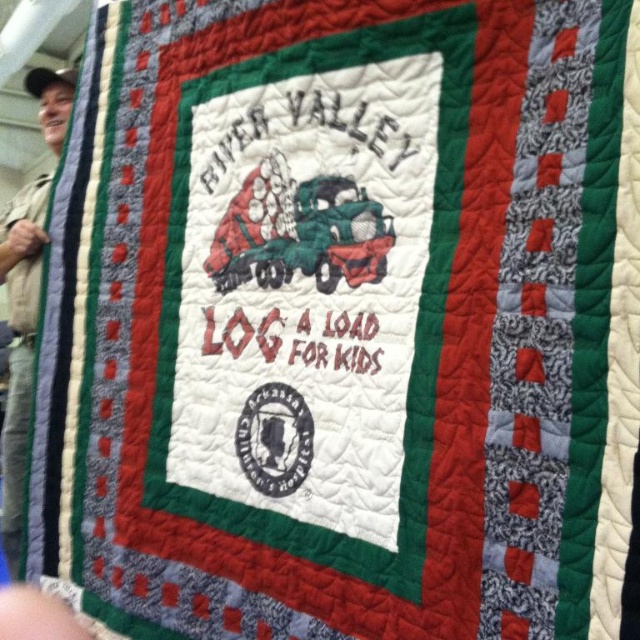
Question: Which point is farther to the camera?

Choices:
 (A) (4, 509)
 (B) (276, 253)

Answer: (A)

Question: Which point is closer to the camera?

Choices:
 (A) (380, 225)
 (B) (26, 440)

Answer: (A)

Question: Observing the image, what is the correct spatial positioning of green matte truck at center in reference to brown fabric shirt at left?

Choices:
 (A) right
 (B) left

Answer: (A)

Question: Is green matte truck at center below brown fabric shirt at left?

Choices:
 (A) no
 (B) yes

Answer: (A)

Question: Is green matte truck at center positioned behind brown fabric shirt at left?

Choices:
 (A) yes
 (B) no

Answer: (B)